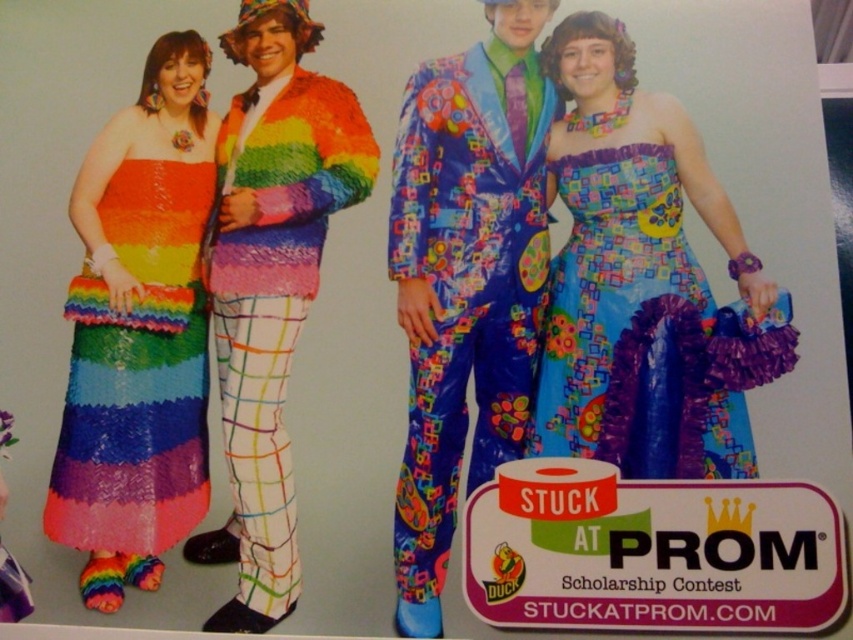
Question: Can you confirm if shiny plastic suit at center is positioned to the left of rainbow sequined suit at center?

Choices:
 (A) no
 (B) yes

Answer: (A)

Question: Is multicolored fabric dress at center positioned before rainbow sequined suit at center?

Choices:
 (A) yes
 (B) no

Answer: (B)

Question: Does shiny plastic suit at center lie behind shiny sequin dress at left?

Choices:
 (A) yes
 (B) no

Answer: (B)

Question: Which point is closer to the camera?

Choices:
 (A) (93, 419)
 (B) (494, 200)

Answer: (A)

Question: Which of the following is the closest to the observer?

Choices:
 (A) (271, 369)
 (B) (663, 216)
 (C) (404, 490)
 (D) (108, 545)

Answer: (D)

Question: Which point is closer to the camera?

Choices:
 (A) shiny sequin dress at left
 (B) shiny plastic suit at center
 (C) rainbow sequined suit at center

Answer: (B)